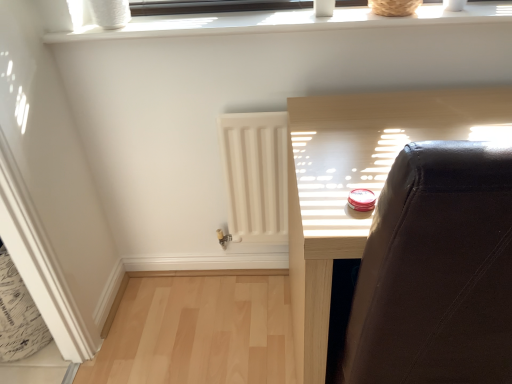
Question: From a real-world perspective, is white matte radiator at center physically above dark brown wood window frame at upper center, which appears as the 2th window frame when ordered from the bottom?

Choices:
 (A) yes
 (B) no

Answer: (B)

Question: From the image's perspective, is white matte radiator at center over dark brown wood window frame at upper center, which appears as the 2th window frame when ordered from the bottom?

Choices:
 (A) no
 (B) yes

Answer: (A)

Question: Is white matte radiator at center bigger than dark brown wood window frame at upper center, which appears as the 2th window frame when ordered from the bottom?

Choices:
 (A) no
 (B) yes

Answer: (B)

Question: Does white matte radiator at center appear on the left side of dark brown wood window frame at upper center, which appears as the 2th window frame when ordered from the bottom?

Choices:
 (A) no
 (B) yes

Answer: (B)

Question: Is white matte radiator at center wider than dark brown wood window frame at upper center, the 1th window frame when ordered from top to bottom?

Choices:
 (A) no
 (B) yes

Answer: (A)

Question: Looking at their shapes, would you say white plastic window frame at upper center, which is the first window frame from bottom to top, is wider or thinner than white matte radiator at center?

Choices:
 (A) thin
 (B) wide

Answer: (B)

Question: In the image, is white plastic window frame at upper center, the 2th window frame from the top, positioned in front of or behind white matte radiator at center?

Choices:
 (A) front
 (B) behind

Answer: (A)

Question: Is point (90, 34) closer or farther from the camera than point (251, 185)?

Choices:
 (A) closer
 (B) farther

Answer: (A)

Question: Based on their positions, is white plastic window frame at upper center, the 2th window frame from the top, located to the left or right of white matte radiator at center?

Choices:
 (A) right
 (B) left

Answer: (A)

Question: Looking at the image, does matte black chair at upper right seem bigger or smaller compared to white plastic window frame at upper center, the 2th window frame from the top?

Choices:
 (A) small
 (B) big

Answer: (B)

Question: Is matte black chair at upper right inside the boundaries of white plastic window frame at upper center, which is the first window frame from bottom to top, or outside?

Choices:
 (A) inside
 (B) outside

Answer: (B)

Question: Relative to white plastic window frame at upper center, which is the first window frame from bottom to top, is matte black chair at upper right in front or behind?

Choices:
 (A) front
 (B) behind

Answer: (A)

Question: Is matte black chair at upper right wider or thinner than white plastic window frame at upper center, the 2th window frame from the top?

Choices:
 (A) thin
 (B) wide

Answer: (B)

Question: From the image's perspective, relative to white plastic window frame at upper center, the 2th window frame from the top, is white matte radiator at center above or below?

Choices:
 (A) below
 (B) above

Answer: (A)

Question: From a real-world perspective, relative to white plastic window frame at upper center, which is the first window frame from bottom to top, is white matte radiator at center vertically above or below?

Choices:
 (A) above
 (B) below

Answer: (B)